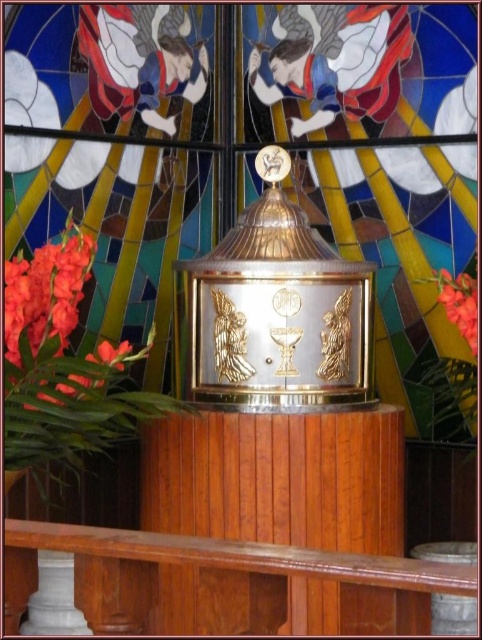
Does stained glass window at center appear under matte red flower at right?

Actually, stained glass window at center is above matte red flower at right.

Who is more distant from viewer, [384,396] or [465,307]?

Point [384,396]

Identify the location of stained glass window at center. This screenshot has width=482, height=640. (360, 70).

Does matte orange flower at lower left come in front of matte red flower at right?

Yes, matte orange flower at lower left is in front of matte red flower at right.

Is matte orange flower at lower left shorter than matte red flower at right?

No, matte orange flower at lower left is not shorter than matte red flower at right.

You are a GUI agent. You are given a task and a screenshot of the screen. Output one action in this format:
    pyautogui.click(x=<x>, y=<y>)
    Task: Click on the matte orange flower at lower left
    The width and height of the screenshot is (482, 640).
    Given the screenshot: What is the action you would take?
    pyautogui.click(x=45, y=296)

In the scene shown: Is stained glass window at center shorter than matte orange flower at lower left?

No.

Which is below, stained glass window at center or matte orange flower at lower left?

Positioned lower is matte orange flower at lower left.

Is point (371, 77) positioned behind point (81, 291)?

Yes, point (371, 77) is behind point (81, 291).

Locate an element on the screen. The width and height of the screenshot is (482, 640). stained glass window at center is located at coordinates (360, 70).